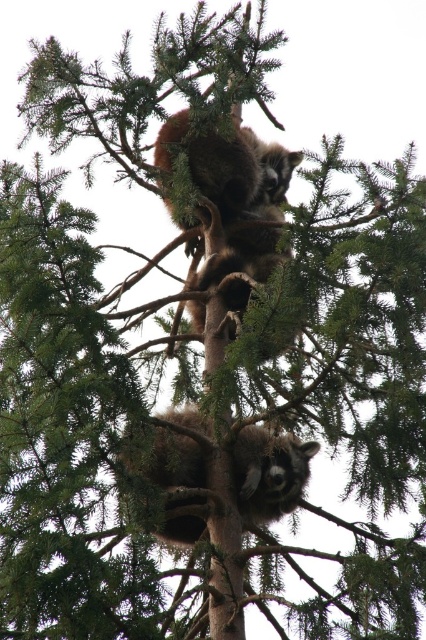
Question: Is fuzzy brown raccoon at upper center in front of fuzzy brown raccoon at center?

Choices:
 (A) yes
 (B) no

Answer: (B)

Question: Can you confirm if fuzzy brown raccoon at upper center is positioned below fuzzy brown raccoon at center?

Choices:
 (A) no
 (B) yes

Answer: (A)

Question: Is fuzzy brown raccoon at upper center closer to the viewer compared to fuzzy brown raccoon at center?

Choices:
 (A) no
 (B) yes

Answer: (A)

Question: Among these objects, which one is farthest from the camera?

Choices:
 (A) fuzzy brown raccoon at center
 (B) fuzzy brown raccoon at upper center

Answer: (B)

Question: Which of the following is the closest to the observer?

Choices:
 (A) fuzzy brown raccoon at center
 (B) fuzzy brown raccoon at upper center

Answer: (A)

Question: Which point is closer to the camera?

Choices:
 (A) (183, 536)
 (B) (184, 248)

Answer: (A)